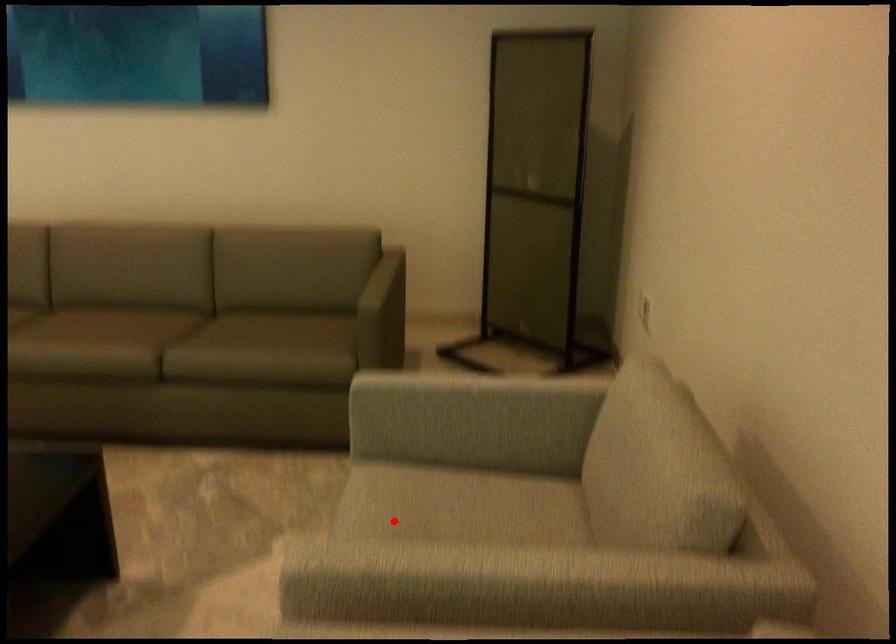
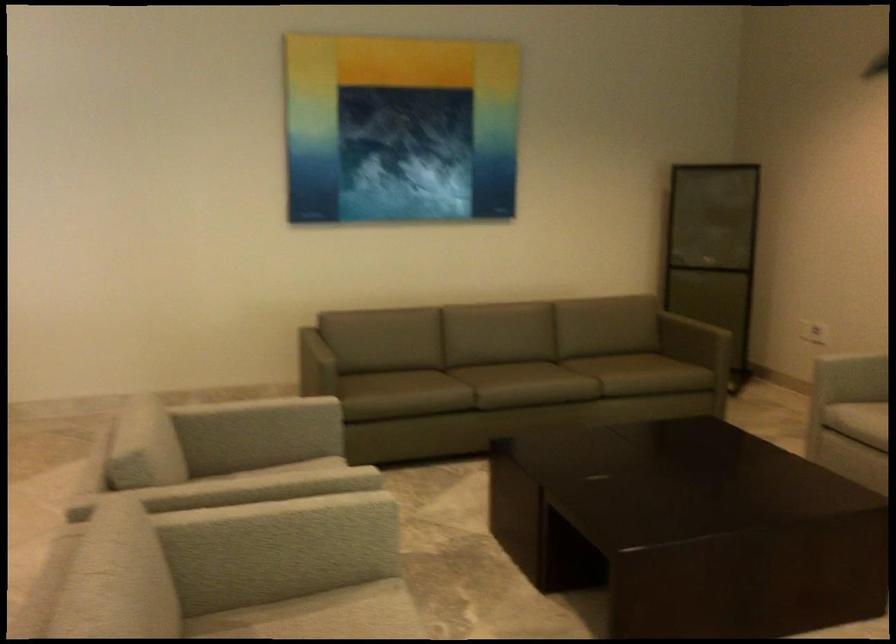
Locate, in the second image, the point that corresponds to the highlighted location in the first image.

(857, 420)